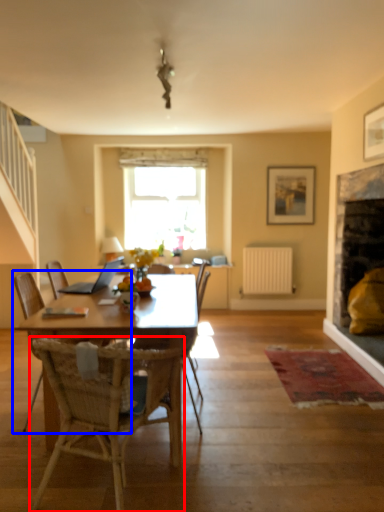
Question: Among these objects, which one is nearest to the camera, chair (highlighted by a red box) or chair (highlighted by a blue box)?

Choices:
 (A) chair
 (B) chair

Answer: (A)